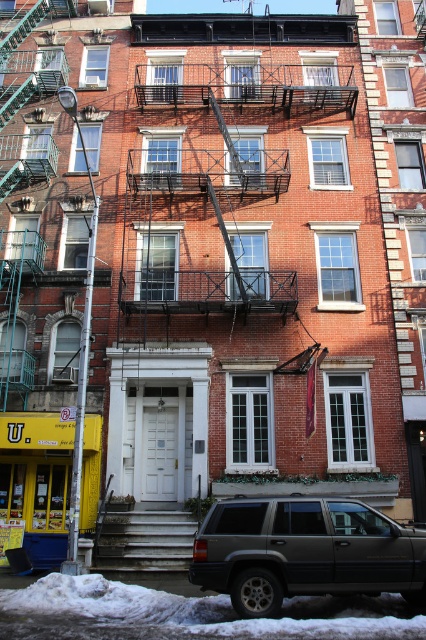
You are a delivery person who needs to park your 1.8 meters tall delivery van. You see the dark gray matte suv at lower right and the white painted wood stairs at center. Which object is taller and can you park your van between them?

The dark gray matte suv at lower right is much taller than the white painted wood stairs at center. Since your van is 1.8 meters tall, you can park it between them as the suv is taller and the stairs are shorter, providing enough vertical space.

You are standing at the entrance of the building and want to park your car in the parking lot behind the dark gray matte suv at lower right. Can you determine the direction you should drive relative to the suv to reach the parking lot?

The dark gray matte suv at lower right is located at point (304,552), which indicates its position on the image. Since you want to park behind it, you should drive in the same direction the suv is facing or follow the path leading towards the parking area behind it.

You are a delivery driver who needs to park your vehicle in front of the building. The parking space available is only 4 meters wide. Can your dark gray matte suv at lower right fit into the space considering the size of the white painted wood stairs at center?

The dark gray matte suv at lower right is larger than the white painted wood stairs at center. Since the parking space is 4 meters wide, the suv may not fit if its width exceeds the space. However, without exact dimensions, it is uncertain. The stairs size comparison suggests the suv is wider, so it might not fit.